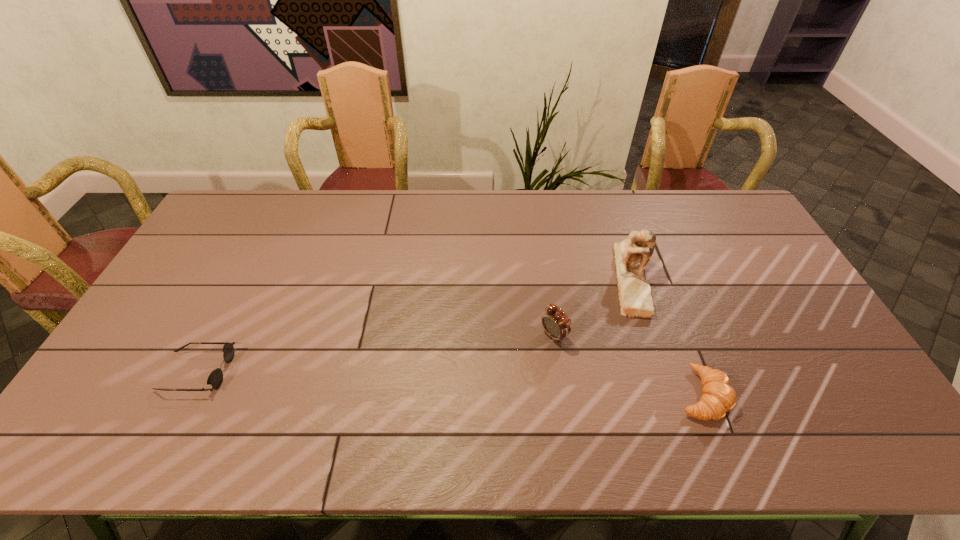
Where is `empty space that is in between the leftmost object and the crescent roll`? This screenshot has width=960, height=540. empty space that is in between the leftmost object and the crescent roll is located at coordinates (449, 383).

Where is `free space between the second shortest object and the sunglasses`? The image size is (960, 540). free space between the second shortest object and the sunglasses is located at coordinates (449, 383).

You are a GUI agent. You are given a task and a screenshot of the screen. Output one action in this format:
    pyautogui.click(x=<x>, y=<y>)
    Task: Click on the vacant area between the alarm clock and the leftmost object
    This screenshot has width=960, height=540.
    Given the screenshot: What is the action you would take?
    pyautogui.click(x=375, y=353)

Where is `free spot between the shortest object and the second shortest object`? free spot between the shortest object and the second shortest object is located at coordinates (449, 383).

This screenshot has width=960, height=540. What are the coordinates of `the closest object to the alarm clock` in the screenshot? It's located at (631, 255).

Identify which object is the second nearest to the alarm clock. Please provide its 2D coordinates. Your answer should be formatted as a tuple, i.e. [(x, y)], where the tuple contains the x and y coordinates of a point satisfying the conditions above.

[(718, 397)]

The image size is (960, 540). I want to click on vacant space that satisfies the following two spatial constraints: 1. on the front side of the third shortest object; 2. on the left side of the second shortest object, so click(x=563, y=394).

I want to click on free space that satisfies the following two spatial constraints: 1. on the back side of the farthest object; 2. on the left side of the alarm clock, so click(x=545, y=277).